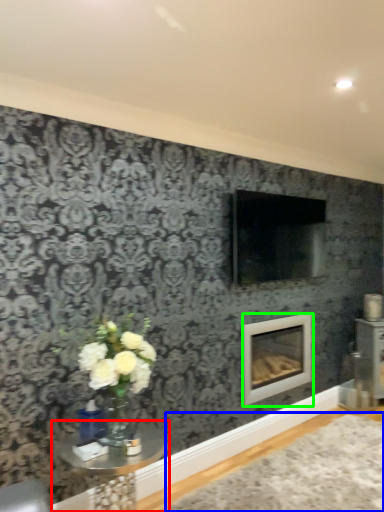
Question: Which is nearer to the table (highlighted by a red box)? plain (highlighted by a blue box) or fireplace (highlighted by a green box).

Choices:
 (A) plain
 (B) fireplace

Answer: (A)